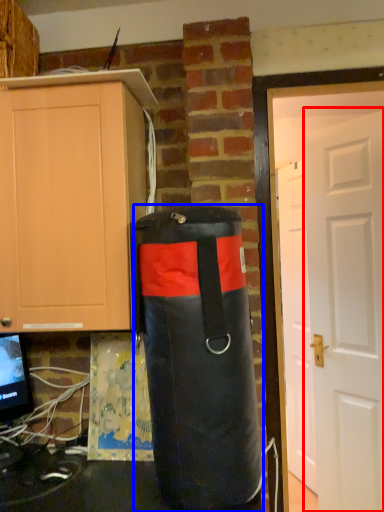
Question: Among these objects, which one is nearest to the camera, door (highlighted by a red box) or punching bag (highlighted by a blue box)?

Choices:
 (A) door
 (B) punching bag

Answer: (B)